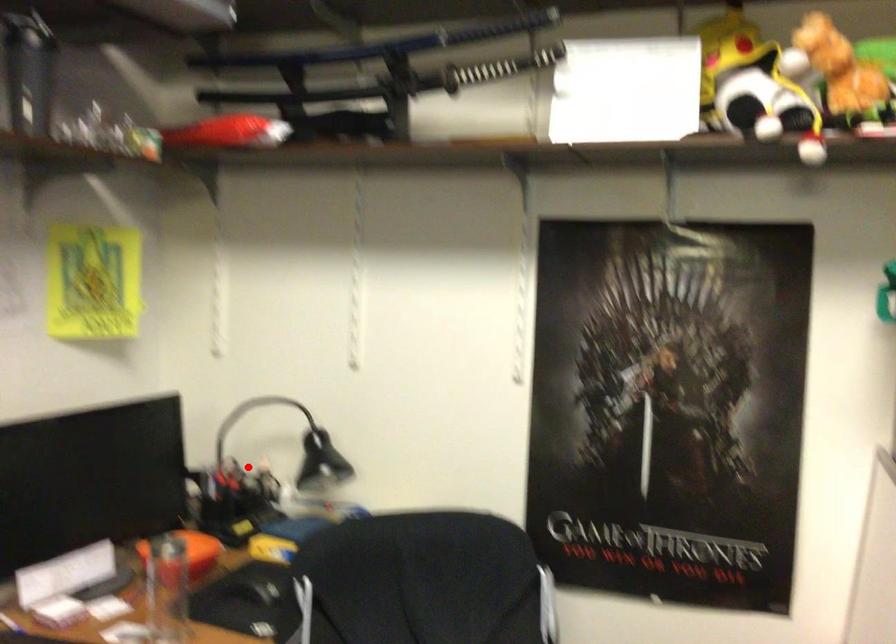
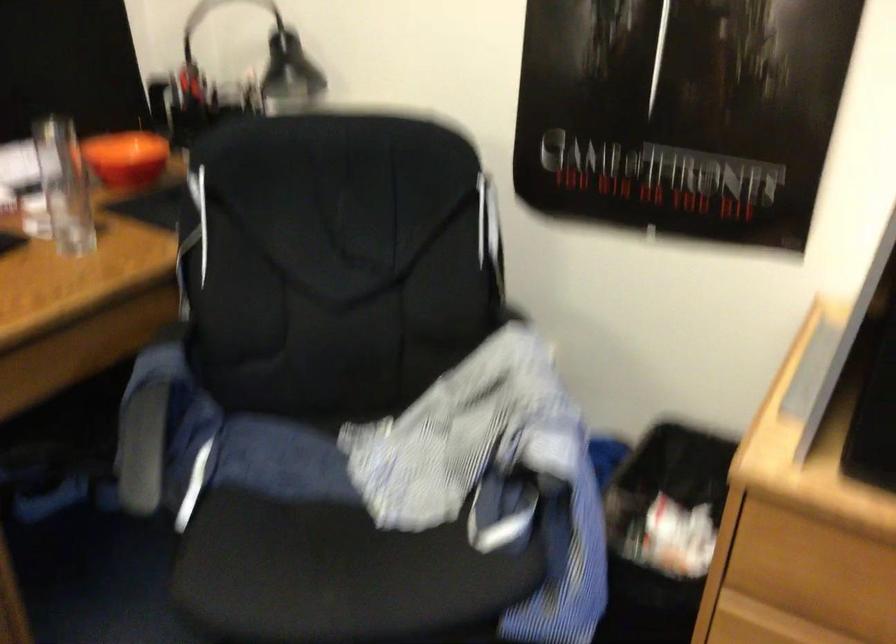
Locate, in the second image, the point that corresponds to the highlighted location in the first image.

(233, 82)